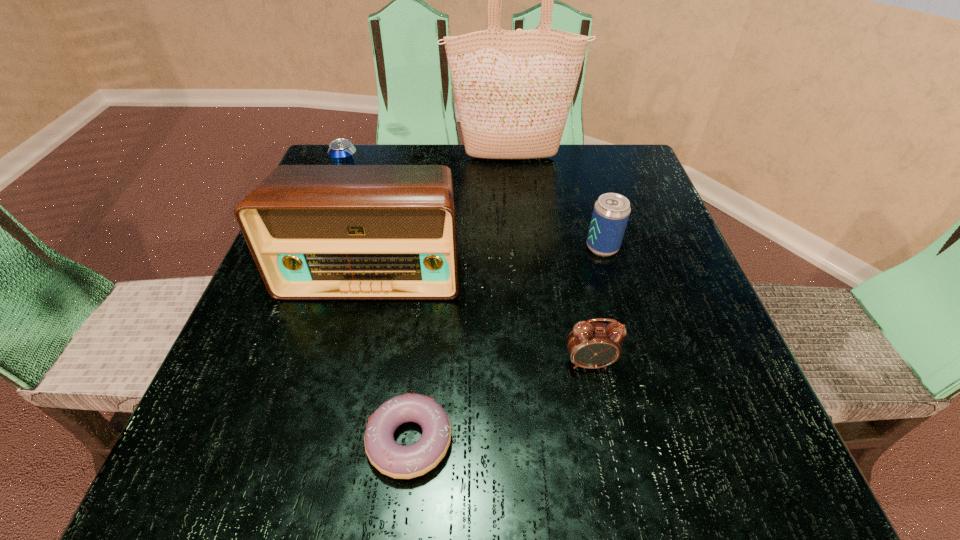
The image size is (960, 540). I want to click on free spot that satisfies the following two spatial constraints: 1. on the back side of the nearest object; 2. on the right side of the nearer beer can, so click(x=432, y=247).

Locate an element on the screen. The height and width of the screenshot is (540, 960). free location that satisfies the following two spatial constraints: 1. on the front side of the fifth nearest object; 2. on the left side of the nearest object is located at coordinates (263, 440).

You are a GUI agent. You are given a task and a screenshot of the screen. Output one action in this format:
    pyautogui.click(x=<x>, y=<y>)
    Task: Click on the free location that satisfies the following two spatial constraints: 1. on the front-facing side of the fifth shortest object; 2. on the left side of the nearest object
    
    Given the screenshot: What is the action you would take?
    pyautogui.click(x=332, y=440)